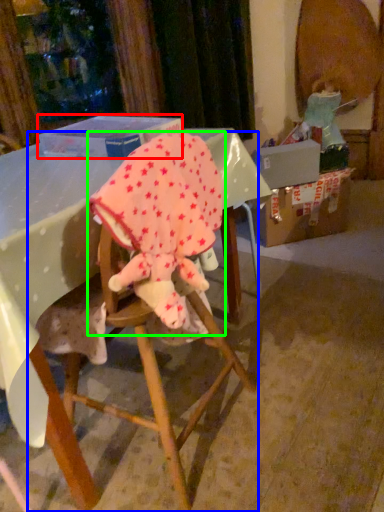
Question: Considering the real-world distances, which object is farthest from box (highlighted by a red box)? chair (highlighted by a blue box) or baby elephant (highlighted by a green box)?

Choices:
 (A) chair
 (B) baby elephant

Answer: (A)